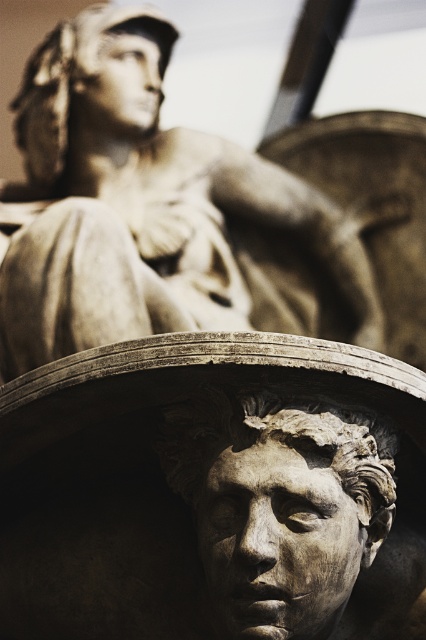
You are an art restorer working on two sculptures in a museum. You have to move the matte stone head at center and the matte bronze head at upper center to a storage room. The storage shelf can only hold items up to the size of the larger sculpture. Which sculpture should you place first to ensure both fit?

The matte bronze head at upper center is larger, so you should place it first on the shelf to ensure there is enough space remaining for the smaller matte stone head at center.